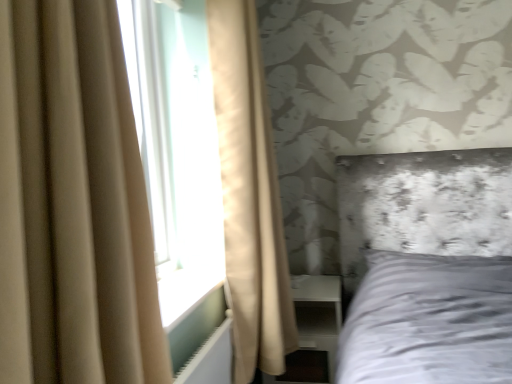
The height and width of the screenshot is (384, 512). In order to click on beige fabric curtain at left, the 1th curtain positioned from the back in this screenshot , I will do `click(249, 195)`.

Image resolution: width=512 pixels, height=384 pixels. In order to click on beige fabric curtain at left, the 1th curtain positioned from the back in this screenshot , I will do `click(249, 195)`.

Considering the relative sizes of beige fabric curtain at left, the 1th curtain positioned from the back, and white glossy dresser at lower right in the image provided, is beige fabric curtain at left, the 1th curtain positioned from the back, taller than white glossy dresser at lower right?

Yes.

In the scene shown: Considering the relative positions of beige fabric curtain at left, positioned as the second curtain in front-to-back order, and white glossy dresser at lower right in the image provided, is beige fabric curtain at left, positioned as the second curtain in front-to-back order, behind white glossy dresser at lower right?

No.

Between beige fabric curtain at left, positioned as the second curtain in front-to-back order, and white glossy dresser at lower right, which one has smaller width?

Thinner between the two is beige fabric curtain at left, positioned as the second curtain in front-to-back order.

Is white glossy dresser at lower right a part of beige fabric curtain at left, positioned as the second curtain in front-to-back order?

No, white glossy dresser at lower right is not inside beige fabric curtain at left, positioned as the second curtain in front-to-back order.

Is white glossy dresser at lower right inside the boundaries of beige fabric curtain at left, the first curtain in the front-to-back sequence, or outside?

white glossy dresser at lower right is spatially situated outside beige fabric curtain at left, the first curtain in the front-to-back sequence.

Which of these two, white glossy dresser at lower right or beige fabric curtain at left, arranged as the 2th curtain when viewed from the back, is wider?

A: Wider between the two is white glossy dresser at lower right.

Looking at this image, is white glossy dresser at lower right turned away from beige fabric curtain at left, arranged as the 2th curtain when viewed from the back?

white glossy dresser at lower right does not have its back to beige fabric curtain at left, arranged as the 2th curtain when viewed from the back.

How many degrees apart are the facing directions of white glossy dresser at lower right and beige fabric curtain at left, arranged as the 2th curtain when viewed from the back?

There is a 90-degree angle between the facing directions of white glossy dresser at lower right and beige fabric curtain at left, arranged as the 2th curtain when viewed from the back.

Considering the sizes of objects white plastic radiator at lower left and beige fabric curtain at left, arranged as the 2th curtain when viewed from the back, in the image provided, who is bigger, white plastic radiator at lower left or beige fabric curtain at left, arranged as the 2th curtain when viewed from the back,?

beige fabric curtain at left, arranged as the 2th curtain when viewed from the back.

Measure the distance from white plastic radiator at lower left to beige fabric curtain at left, arranged as the 2th curtain when viewed from the back.

The distance of white plastic radiator at lower left from beige fabric curtain at left, arranged as the 2th curtain when viewed from the back, is 26.93 inches.

The image size is (512, 384). In order to click on the 1st curtain above the white plastic radiator at lower left (from the image's perspective) in this screenshot , I will do `click(73, 203)`.

Is white plastic radiator at lower left taller or shorter than beige fabric curtain at left, the first curtain in the front-to-back sequence?

white plastic radiator at lower left is shorter than beige fabric curtain at left, the first curtain in the front-to-back sequence.

From the picture: Is beige fabric curtain at left, the first curtain in the front-to-back sequence, far from white glossy dresser at lower right?

beige fabric curtain at left, the first curtain in the front-to-back sequence, is far away from white glossy dresser at lower right.

Which of these two, beige fabric curtain at left, the first curtain in the front-to-back sequence, or white glossy dresser at lower right, is wider?

white glossy dresser at lower right is wider.

Is white glossy dresser at lower right at the back of beige fabric curtain at left, arranged as the 2th curtain when viewed from the back?

No, beige fabric curtain at left, arranged as the 2th curtain when viewed from the back, is not facing the opposite direction of white glossy dresser at lower right.

Is beige fabric curtain at left, the first curtain in the front-to-back sequence, situated inside white plastic radiator at lower left or outside?

beige fabric curtain at left, the first curtain in the front-to-back sequence, is spatially situated outside white plastic radiator at lower left.

What's the angular difference between beige fabric curtain at left, arranged as the 2th curtain when viewed from the back, and white plastic radiator at lower left's facing directions?

The angular difference between beige fabric curtain at left, arranged as the 2th curtain when viewed from the back, and white plastic radiator at lower left is 0.269 degrees.

From a real-world perspective, which object rests below the other?

white plastic radiator at lower left, from a real-world perspective.

From the image's perspective, is beige fabric curtain at left, the first curtain in the front-to-back sequence, below white plastic radiator at lower left?

Incorrect, from the image's perspective, beige fabric curtain at left, the first curtain in the front-to-back sequence, is higher than white plastic radiator at lower left.

From the image's perspective, between beige fabric curtain at left, the 1th curtain positioned from the back, and beige fabric curtain at left, arranged as the 2th curtain when viewed from the back, which one is located above?

beige fabric curtain at left, the 1th curtain positioned from the back, is shown above in the image.

Between beige fabric curtain at left, the 1th curtain positioned from the back, and beige fabric curtain at left, arranged as the 2th curtain when viewed from the back, which one has less height?

Standing shorter between the two is beige fabric curtain at left, arranged as the 2th curtain when viewed from the back.

Considering the relative positions of beige fabric curtain at left, positioned as the second curtain in front-to-back order, and beige fabric curtain at left, arranged as the 2th curtain when viewed from the back, in the image provided, is beige fabric curtain at left, positioned as the second curtain in front-to-back order, in front of beige fabric curtain at left, arranged as the 2th curtain when viewed from the back,?

No, beige fabric curtain at left, positioned as the second curtain in front-to-back order, is behind beige fabric curtain at left, arranged as the 2th curtain when viewed from the back.

Is point (247, 64) behind point (38, 281)?

Yes, point (247, 64) is behind point (38, 281).

Can you confirm if beige fabric curtain at left, the 1th curtain positioned from the back, is positioned to the left of white plastic radiator at lower left?

No.

In the image, is beige fabric curtain at left, positioned as the second curtain in front-to-back order, positioned in front of or behind white plastic radiator at lower left?

In the image, beige fabric curtain at left, positioned as the second curtain in front-to-back order, appears behind white plastic radiator at lower left.

Which object is thinner, beige fabric curtain at left, positioned as the second curtain in front-to-back order, or white plastic radiator at lower left?

white plastic radiator at lower left.

Could you tell me if beige fabric curtain at left, positioned as the second curtain in front-to-back order, is turned towards white plastic radiator at lower left?

No, beige fabric curtain at left, positioned as the second curtain in front-to-back order, does not turn towards white plastic radiator at lower left.

Where is `dresser behind the beige fabric curtain at left, the 1th curtain positioned from the back`? This screenshot has width=512, height=384. dresser behind the beige fabric curtain at left, the 1th curtain positioned from the back is located at coordinates (313, 331).

Locate an element on the screen. This screenshot has height=384, width=512. dresser directly beneath the beige fabric curtain at left, the first curtain in the front-to-back sequence (from a real-world perspective) is located at coordinates (313, 331).

Which object lies further to the anchor point beige fabric curtain at left, arranged as the 2th curtain when viewed from the back, white glossy dresser at lower right or white plastic radiator at lower left?

The object further to beige fabric curtain at left, arranged as the 2th curtain when viewed from the back, is white glossy dresser at lower right.

From the image, which object appears to be farther from beige fabric curtain at left, arranged as the 2th curtain when viewed from the back, beige fabric curtain at left, the 1th curtain positioned from the back, or white glossy dresser at lower right?

white glossy dresser at lower right lies further to beige fabric curtain at left, arranged as the 2th curtain when viewed from the back, than the other object.

Based on the photo, when comparing their distances from white glossy dresser at lower right, does beige fabric curtain at left, arranged as the 2th curtain when viewed from the back, or white plastic radiator at lower left seem closer?

white plastic radiator at lower left lies closer to white glossy dresser at lower right than the other object.

When comparing their distances from white plastic radiator at lower left, does white glossy dresser at lower right or beige fabric curtain at left, the first curtain in the front-to-back sequence, seem further?

Among the two, beige fabric curtain at left, the first curtain in the front-to-back sequence, is located further to white plastic radiator at lower left.

Looking at the image, which one is located closer to white glossy dresser at lower right, white plastic radiator at lower left or beige fabric curtain at left, the 1th curtain positioned from the back?

beige fabric curtain at left, the 1th curtain positioned from the back.

Which object lies nearer to the anchor point beige fabric curtain at left, the 1th curtain positioned from the back, beige fabric curtain at left, arranged as the 2th curtain when viewed from the back, or white glossy dresser at lower right?

Among the two, white glossy dresser at lower right is located nearer to beige fabric curtain at left, the 1th curtain positioned from the back.

Considering their positions, is beige fabric curtain at left, positioned as the second curtain in front-to-back order, positioned closer to white plastic radiator at lower left than beige fabric curtain at left, arranged as the 2th curtain when viewed from the back?

The object closer to white plastic radiator at lower left is beige fabric curtain at left, positioned as the second curtain in front-to-back order.

Which object lies nearer to the anchor point white glossy dresser at lower right, white plastic radiator at lower left or beige fabric curtain at left, the first curtain in the front-to-back sequence?

white plastic radiator at lower left lies closer to white glossy dresser at lower right than the other object.

Where is `radiator between beige fabric curtain at left, arranged as the 2th curtain when viewed from the back, and beige fabric curtain at left, positioned as the second curtain in front-to-back order, from front to back`? This screenshot has height=384, width=512. radiator between beige fabric curtain at left, arranged as the 2th curtain when viewed from the back, and beige fabric curtain at left, positioned as the second curtain in front-to-back order, from front to back is located at coordinates (211, 358).

At what (x,y) coordinates should I click in order to perform the action: click on radiator located between beige fabric curtain at left, the first curtain in the front-to-back sequence, and white glossy dresser at lower right in the depth direction. Please return your answer as a coordinate pair (x, y). Looking at the image, I should click on (211, 358).

Find the location of `curtain between beige fabric curtain at left, arranged as the 2th curtain when viewed from the back, and white glossy dresser at lower right in the front-back direction`. curtain between beige fabric curtain at left, arranged as the 2th curtain when viewed from the back, and white glossy dresser at lower right in the front-back direction is located at coordinates (249, 195).

At what (x,y) coordinates should I click in order to perform the action: click on curtain between white plastic radiator at lower left and white glossy dresser at lower right in the front-back direction. Please return your answer as a coordinate pair (x, y). Image resolution: width=512 pixels, height=384 pixels. Looking at the image, I should click on (249, 195).